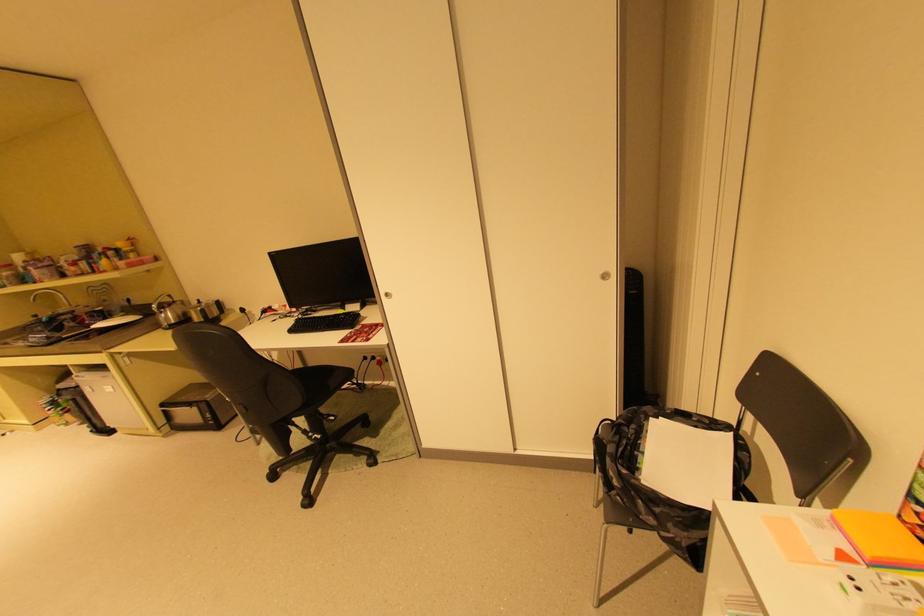
What do you see at coordinates (52, 296) in the screenshot?
I see `a faucet handle` at bounding box center [52, 296].